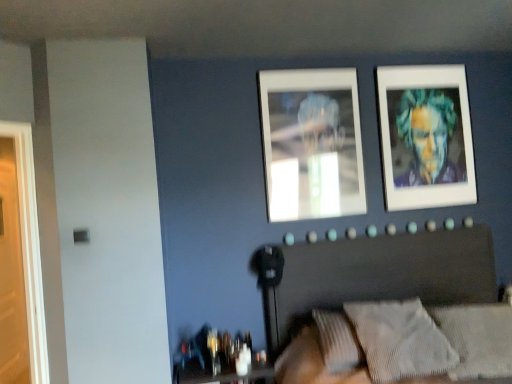
The width and height of the screenshot is (512, 384). What do you see at coordinates (478, 339) in the screenshot?
I see `textured gray pillow at lower right, marked as the 1th pillow in a right-to-left arrangement` at bounding box center [478, 339].

This screenshot has width=512, height=384. What do you see at coordinates (312, 143) in the screenshot?
I see `metallic reflective frame at upper center, which is counted as the 1th picture frame, starting from the left` at bounding box center [312, 143].

What is the approximate width of textured gray pillow at lower right, the 2th pillow when ordered from right to left?

The width of textured gray pillow at lower right, the 2th pillow when ordered from right to left, is 40.18 centimeters.

In order to face textured gray headboard at center, should I rotate leftwards or rightwards?

Rotate right and turn 30.333 degrees.

Measure the distance between point (x=261, y=365) and camera.

Point (x=261, y=365) is 2.73 meters away from camera.

This screenshot has width=512, height=384. I want to click on textured gray pillow at lower right, marked as the 1th pillow in a right-to-left arrangement, so (x=478, y=339).

From the image's perspective, does textured gray pillow at lower right, arranged as the 1th pillow when viewed from the left, appear lower than metallic silver portrait at upper right, which is the first picture frame from right to left?

Yes, from the image's perspective, textured gray pillow at lower right, arranged as the 1th pillow when viewed from the left, is beneath metallic silver portrait at upper right, which is the first picture frame from right to left.

Between textured gray pillow at lower right, arranged as the 1th pillow when viewed from the left, and metallic silver portrait at upper right, which is counted as the first picture frame, starting from the back, which one appears on the right side from the viewer's perspective?

Positioned to the right is metallic silver portrait at upper right, which is counted as the first picture frame, starting from the back.

Who is taller, textured gray pillow at lower right, arranged as the 1th pillow when viewed from the left, or metallic silver portrait at upper right, which is counted as the first picture frame, starting from the back?

metallic silver portrait at upper right, which is counted as the first picture frame, starting from the back, is taller.

From the textured gray pillow at lower right, arranged as the 1th pillow when viewed from the left, count 2nd picture frames backward and point to it. Please provide its 2D coordinates.

[(426, 137)]

Does metallic silver portrait at upper right, which ranks as the second picture frame in left-to-right order, have a smaller size compared to metallic reflective frame at upper center, placed as the 2th picture frame when sorted from right to left?

Incorrect, metallic silver portrait at upper right, which ranks as the second picture frame in left-to-right order, is not smaller in size than metallic reflective frame at upper center, placed as the 2th picture frame when sorted from right to left.

From the picture: Who is taller, metallic silver portrait at upper right, which is counted as the first picture frame, starting from the back, or metallic reflective frame at upper center, which is counted as the 1th picture frame, starting from the left?

metallic silver portrait at upper right, which is counted as the first picture frame, starting from the back, is taller.

Identify the location of picture frame that appears above the metallic reflective frame at upper center, which is counted as the 1th picture frame, starting from the left (from the image's perspective). (426, 137).

How many degrees apart are the facing directions of metallic silver portrait at upper right, which ranks as the second picture frame in left-to-right order, and metallic reflective frame at upper center, acting as the first picture frame starting from the front?

metallic silver portrait at upper right, which ranks as the second picture frame in left-to-right order, and metallic reflective frame at upper center, acting as the first picture frame starting from the front, are facing 0.00588 degrees away from each other.

Is textured gray headboard at center at the left side of translucent glass table at lower center?

No.

From the image's perspective, is textured gray headboard at center below translucent glass table at lower center?

No, from the image's perspective, textured gray headboard at center is not below translucent glass table at lower center.

Is textured gray headboard at center directly adjacent to translucent glass table at lower center?

textured gray headboard at center is not next to translucent glass table at lower center, and they're not touching.

Is textured gray headboard at center beside textured gray pillow at lower right, marked as the 1th pillow in a right-to-left arrangement?

No.

Is textured gray headboard at center looking in the opposite direction of textured gray pillow at lower right, marked as the 1th pillow in a right-to-left arrangement?

Yes, textured gray headboard at center's orientation is away from textured gray pillow at lower right, marked as the 1th pillow in a right-to-left arrangement.

Who is smaller, textured gray headboard at center or textured gray pillow at lower right, marked as the 1th pillow in a right-to-left arrangement?

textured gray pillow at lower right, marked as the 1th pillow in a right-to-left arrangement, is smaller.

Consider the image. Is the depth of textured gray headboard at center greater than that of textured gray pillow at lower right, arranged as the 2th pillow when viewed from the left?

No, it is in front of textured gray pillow at lower right, arranged as the 2th pillow when viewed from the left.

Between metallic silver portrait at upper right, positioned as the 2th picture frame in front-to-back order, and textured gray pillow at lower right, arranged as the 2th pillow when viewed from the left, which one has smaller width?

metallic silver portrait at upper right, positioned as the 2th picture frame in front-to-back order, is thinner.

Is metallic silver portrait at upper right, which ranks as the second picture frame in left-to-right order, positioned far away from textured gray pillow at lower right, arranged as the 2th pillow when viewed from the left?

Yes.

Which of these two, metallic silver portrait at upper right, positioned as the 2th picture frame in front-to-back order, or textured gray pillow at lower right, marked as the 1th pillow in a right-to-left arrangement, stands shorter?

textured gray pillow at lower right, marked as the 1th pillow in a right-to-left arrangement.

From the image's perspective, is metallic silver portrait at upper right, positioned as the 2th picture frame in front-to-back order, on textured gray pillow at lower right, marked as the 1th pillow in a right-to-left arrangement?

Yes.

From the image's perspective, is metallic reflective frame at upper center, the 2th picture frame positioned from the back, located beneath metallic silver portrait at upper right, positioned as the 2th picture frame in front-to-back order?

Yes, from the image's perspective, metallic reflective frame at upper center, the 2th picture frame positioned from the back, is below metallic silver portrait at upper right, positioned as the 2th picture frame in front-to-back order.

Which is further, (x=356, y=84) or (x=464, y=100)?

The point (x=464, y=100) is farther.

Considering the positions of objects metallic reflective frame at upper center, which is counted as the 1th picture frame, starting from the left, and metallic silver portrait at upper right, which is the first picture frame from right to left, in the image provided, who is more to the left, metallic reflective frame at upper center, which is counted as the 1th picture frame, starting from the left, or metallic silver portrait at upper right, which is the first picture frame from right to left,?

From the viewer's perspective, metallic reflective frame at upper center, which is counted as the 1th picture frame, starting from the left, appears more on the left side.

Considering the points (362, 279) and (396, 331), which point is in front, point (362, 279) or point (396, 331)?

Point (396, 331)

The image size is (512, 384). What are the coordinates of `bed below the textured gray pillow at lower right, arranged as the 1th pillow when viewed from the left (from a real-world perspective)` in the screenshot? It's located at (373, 273).

From a real-world perspective, which is physically below, textured gray headboard at center or textured gray pillow at lower right, arranged as the 1th pillow when viewed from the left?

In real-world perspective, textured gray headboard at center is lower.

From the image's perspective, which is above, textured gray headboard at center or textured gray pillow at lower right, arranged as the 1th pillow when viewed from the left?

textured gray pillow at lower right, arranged as the 1th pillow when viewed from the left, from the image's perspective.

You are a GUI agent. You are given a task and a screenshot of the screen. Output one action in this format:
    pyautogui.click(x=<x>, y=<y>)
    Task: Click on the pillow that is the 1st object directly below the metallic silver portrait at upper right, which ranks as the second picture frame in left-to-right order (from a real-world perspective)
    This screenshot has width=512, height=384.
    Given the screenshot: What is the action you would take?
    pyautogui.click(x=400, y=340)

At what (x,y) coordinates should I click in order to perform the action: click on picture frame above the metallic reflective frame at upper center, the 2th picture frame positioned from the back (from a real-world perspective). Please return your answer as a coordinate pair (x, y). The height and width of the screenshot is (384, 512). Looking at the image, I should click on (426, 137).

Which object lies further to the anchor point translucent glass table at lower center, textured gray headboard at center or metallic silver portrait at upper right, which ranks as the second picture frame in left-to-right order?

Among the two, metallic silver portrait at upper right, which ranks as the second picture frame in left-to-right order, is located further to translucent glass table at lower center.

Considering their positions, is textured gray headboard at center positioned closer to textured gray pillow at lower right, arranged as the 2th pillow when viewed from the left, than translucent glass table at lower center?

textured gray headboard at center.

Based on their spatial positions, is textured gray pillow at lower right, marked as the 1th pillow in a right-to-left arrangement, or textured gray headboard at center closer to translucent glass table at lower center?

The object closer to translucent glass table at lower center is textured gray headboard at center.

Estimate the real-world distances between objects in this image. Which object is further from metallic reflective frame at upper center, the 2th picture frame positioned from the back, textured gray headboard at center or translucent glass table at lower center?

translucent glass table at lower center lies further to metallic reflective frame at upper center, the 2th picture frame positioned from the back, than the other object.

Based on their spatial positions, is textured gray headboard at center or textured gray pillow at lower right, arranged as the 1th pillow when viewed from the left, closer to translucent glass table at lower center?

textured gray headboard at center.

From the image, which object appears to be nearer to translucent glass table at lower center, metallic silver portrait at upper right, positioned as the 2th picture frame in front-to-back order, or metallic reflective frame at upper center, acting as the first picture frame starting from the front?

Among the two, metallic reflective frame at upper center, acting as the first picture frame starting from the front, is located nearer to translucent glass table at lower center.

Looking at the image, which one is located further to metallic silver portrait at upper right, which ranks as the second picture frame in left-to-right order, translucent glass table at lower center or textured gray pillow at lower right, arranged as the 1th pillow when viewed from the left?

Based on the image, translucent glass table at lower center appears to be further to metallic silver portrait at upper right, which ranks as the second picture frame in left-to-right order.

Estimate the real-world distances between objects in this image. Which object is further from textured gray headboard at center, translucent glass table at lower center or textured gray pillow at lower right, arranged as the 2th pillow when viewed from the left?

translucent glass table at lower center is positioned further to the anchor textured gray headboard at center.

This screenshot has height=384, width=512. Identify the location of pillow between textured gray headboard at center and textured gray pillow at lower right, arranged as the 1th pillow when viewed from the left, from front to back. (478, 339).

Locate an element on the screen. The width and height of the screenshot is (512, 384). pillow between metallic reflective frame at upper center, which is counted as the 1th picture frame, starting from the left, and textured gray pillow at lower right, arranged as the 1th pillow when viewed from the left, in the up-down direction is located at coordinates click(x=478, y=339).

Identify the location of picture frame between metallic silver portrait at upper right, positioned as the 2th picture frame in front-to-back order, and translucent glass table at lower center from top to bottom. Image resolution: width=512 pixels, height=384 pixels. (312, 143).

Find the location of a particular element. This screenshot has height=384, width=512. picture frame between metallic silver portrait at upper right, which ranks as the second picture frame in left-to-right order, and textured gray pillow at lower right, marked as the 1th pillow in a right-to-left arrangement, in the up-down direction is located at coordinates (312, 143).